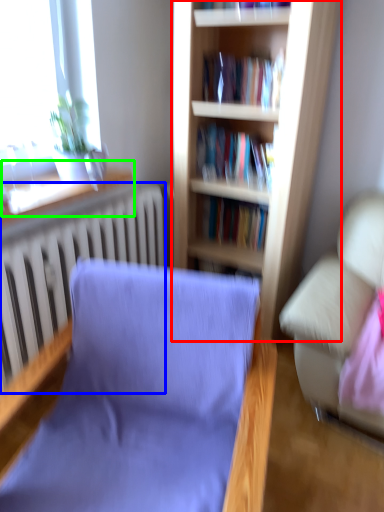
Question: Based on their relative distances, which object is nearer to bookcase (highlighted by a red box)? Choose from radiator (highlighted by a blue box) and window sill (highlighted by a green box).

Choices:
 (A) radiator
 (B) window sill

Answer: (A)